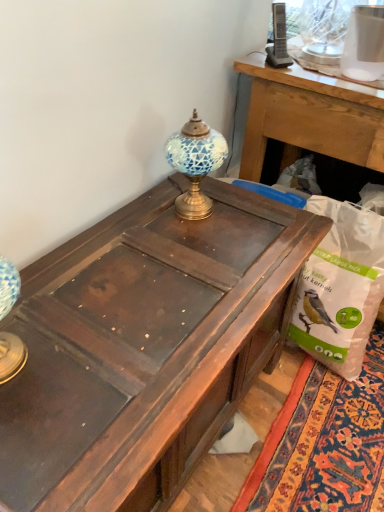
Question: From a real-world perspective, is dark brown wood desk at center above or below blue mosaic glass at center?

Choices:
 (A) below
 (B) above

Answer: (A)

Question: Based on their positions, is dark brown wood desk at center located to the left or right of blue mosaic glass at center?

Choices:
 (A) right
 (B) left

Answer: (B)

Question: Which object is positioned closest to the blue mosaic glass at center?

Choices:
 (A) white plastic bag at lower right
 (B) dark brown wood desk at center

Answer: (B)

Question: Considering the real-world distances, which object is farthest from the blue mosaic glass at center?

Choices:
 (A) dark brown wood desk at center
 (B) white plastic bag at lower right

Answer: (B)